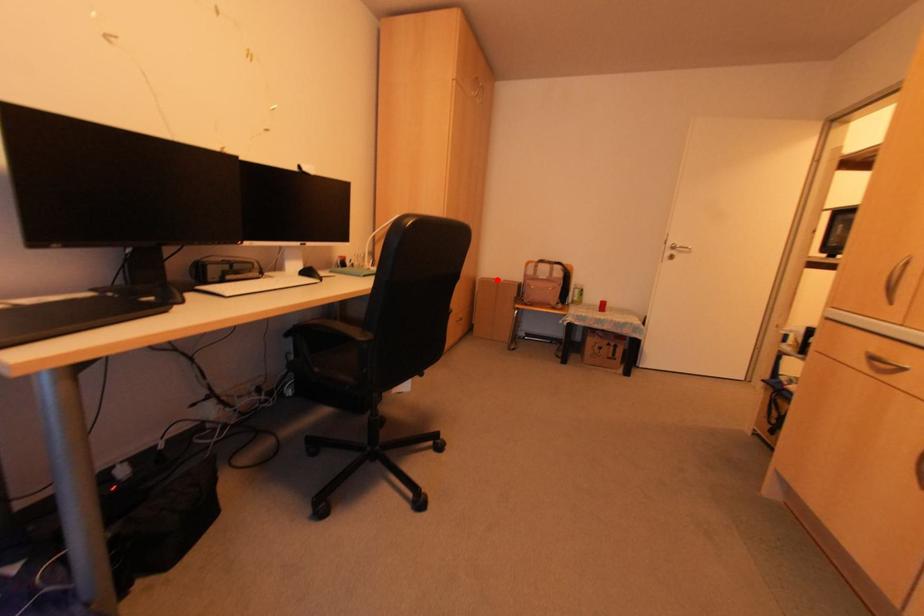
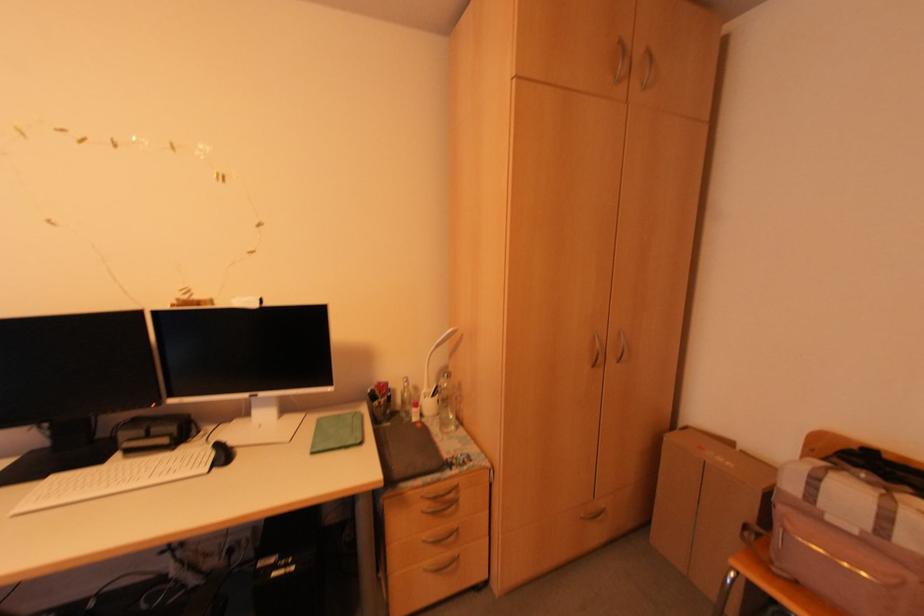
Question: I am providing you with two images of the same scene from different viewpoints. Image1 has a red point marked. In image2, the corresponding 3D location appears at what relative position? Reply with the corresponding letter.

Choices:
 (A) Closer
 (B) Farther

Answer: (B)